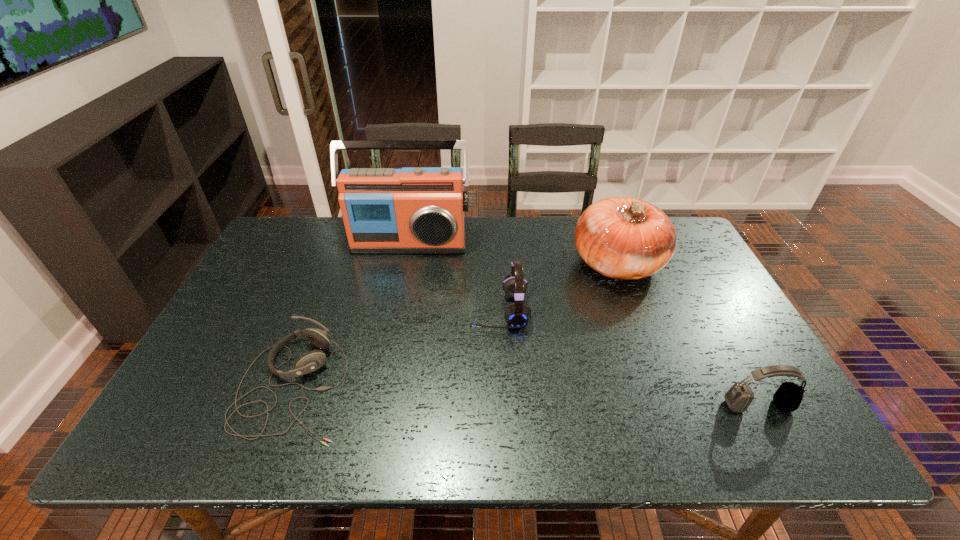
Identify which headset is the second nearest to the fourth tallest object. Please provide its 2D coordinates. Your answer should be formatted as a tuple, i.e. [(x, y)], where the tuple contains the x and y coordinates of a point satisfying the conditions above.

[(311, 361)]

Locate which headset is the second closest to the fourth tallest object. Please provide its 2D coordinates. Your answer should be formatted as a tuple, i.e. [(x, y)], where the tuple contains the x and y coordinates of a point satisfying the conditions above.

[(311, 361)]

Identify the location of free space that satisfies the following two spatial constraints: 1. on the front-facing side of the pumpkin; 2. on the right side of the tallest object. Image resolution: width=960 pixels, height=540 pixels. (405, 264).

Locate an element on the screen. The height and width of the screenshot is (540, 960). free space in the image that satisfies the following two spatial constraints: 1. on the front-facing side of the radio receiver; 2. on the outer surface of the shortest object is located at coordinates (381, 384).